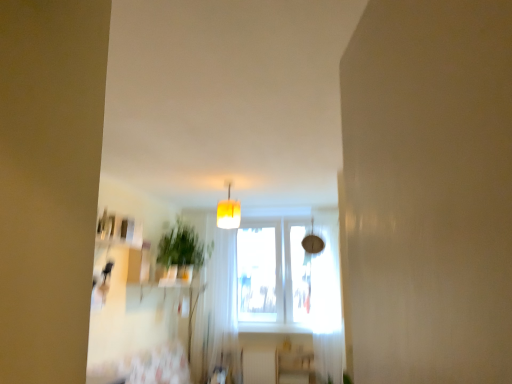
The width and height of the screenshot is (512, 384). What do you see at coordinates (223, 305) in the screenshot? I see `white sheer curtain at center, which appears as the 2th curtain when viewed from the right` at bounding box center [223, 305].

In order to click on wooden shelf at lower center in this screenshot , I will do [296, 367].

At what (x,y) coordinates should I click in order to perform the action: click on white sheer curtain at right, which appears as the 2th curtain when viewed from the left. Please return your answer as a coordinate pair (x, y). The height and width of the screenshot is (384, 512). Looking at the image, I should click on (327, 307).

From a real-world perspective, which is physically below, white sheer curtain at center, which appears as the 2th curtain when viewed from the right, or yellow fabric lampshade at center?

From a 3D spatial view, white sheer curtain at center, which appears as the 2th curtain when viewed from the right, is below.

Can you confirm if white sheer curtain at center, which appears as the 2th curtain when viewed from the right, is smaller than yellow fabric lampshade at center?

No, white sheer curtain at center, which appears as the 2th curtain when viewed from the right, is not smaller than yellow fabric lampshade at center.

Identify the location of light fixture lying above the white sheer curtain at center, which appears as the 2th curtain when viewed from the right (from the image's perspective). (228, 212).

From a real-world perspective, which object rests below the other?

white sheer curtain at right, which appears as the 1th curtain when viewed from the right, from a real-world perspective.

Is white sheer curtain at center, which appears as the 2th curtain when viewed from the right, facing towards white sheer curtain at right, which appears as the 1th curtain when viewed from the right?

No, white sheer curtain at center, which appears as the 2th curtain when viewed from the right, does not turn towards white sheer curtain at right, which appears as the 1th curtain when viewed from the right.

In the image, is white sheer curtain at center, marked as the first curtain in a left-to-right arrangement, positioned in front of or behind white sheer curtain at right, which appears as the 2th curtain when viewed from the left?

Clearly, white sheer curtain at center, marked as the first curtain in a left-to-right arrangement, is behind white sheer curtain at right, which appears as the 2th curtain when viewed from the left.

Can you tell me how much white sheer curtain at center, which appears as the 2th curtain when viewed from the right, and white sheer curtain at right, which appears as the 1th curtain when viewed from the right, differ in facing direction?

There is a 0.000287-degree angle between the facing directions of white sheer curtain at center, which appears as the 2th curtain when viewed from the right, and white sheer curtain at right, which appears as the 1th curtain when viewed from the right.

Consider the image. Is white sheer curtain at right, which appears as the 2th curtain when viewed from the left, to the right of green leafy plant at center from the viewer's perspective?

Yes.

Which is in front, white sheer curtain at right, which appears as the 1th curtain when viewed from the right, or green leafy plant at center?

green leafy plant at center.

Is white sheer curtain at right, which appears as the 2th curtain when viewed from the left, spatially inside green leafy plant at center, or outside of it?

white sheer curtain at right, which appears as the 2th curtain when viewed from the left, exists outside the volume of green leafy plant at center.

Does white sheer curtain at right, which appears as the 1th curtain when viewed from the right, touch green leafy plant at center?

white sheer curtain at right, which appears as the 1th curtain when viewed from the right, and green leafy plant at center are clearly separated.

Is green leafy plant at center facing towards white sheer curtain at center, marked as the first curtain in a left-to-right arrangement?

No.

Is green leafy plant at center positioned before white sheer curtain at center, which appears as the 2th curtain when viewed from the right?

That is True.

Can you confirm if green leafy plant at center is wider than white sheer curtain at center, marked as the first curtain in a left-to-right arrangement?

Indeed, green leafy plant at center has a greater width compared to white sheer curtain at center, marked as the first curtain in a left-to-right arrangement.

From a real-world perspective, which curtain is the 1st one underneath the green leafy plant at center? Please provide its 2D coordinates.

[(223, 305)]

Considering the positions of points (302, 356) and (217, 314), is point (302, 356) farther from camera compared to point (217, 314)?

That is False.

Would you say wooden shelf at lower center is outside white sheer curtain at center, marked as the first curtain in a left-to-right arrangement?

Yes, wooden shelf at lower center is located beyond the bounds of white sheer curtain at center, marked as the first curtain in a left-to-right arrangement.

Which of these two, wooden shelf at lower center or white sheer curtain at center, marked as the first curtain in a left-to-right arrangement, is thinner?

wooden shelf at lower center.

Considering the sizes of objects wooden shelf at lower center and white sheer curtain at center, which appears as the 2th curtain when viewed from the right, in the image provided, who is shorter, wooden shelf at lower center or white sheer curtain at center, which appears as the 2th curtain when viewed from the right,?

wooden shelf at lower center is shorter.

Does yellow fabric lampshade at center come behind white sheer curtain at center, marked as the first curtain in a left-to-right arrangement?

No.

Is yellow fabric lampshade at center not close to white sheer curtain at center, marked as the first curtain in a left-to-right arrangement?

Yes.

From a real-world perspective, which is physically above, yellow fabric lampshade at center or white sheer curtain at center, marked as the first curtain in a left-to-right arrangement?

In real-world perspective, yellow fabric lampshade at center is above.

From the image's perspective, which is below, yellow fabric lampshade at center or white sheer curtain at center, which appears as the 2th curtain when viewed from the right?

white sheer curtain at center, which appears as the 2th curtain when viewed from the right, appears lower in the image.

Is white sheer curtain at center, marked as the first curtain in a left-to-right arrangement, looking in the opposite direction of green leafy plant at center?

Yes, green leafy plant at center is at the back of white sheer curtain at center, marked as the first curtain in a left-to-right arrangement.

The width and height of the screenshot is (512, 384). What are the coordinates of `houseplant in front of the white sheer curtain at center, which appears as the 2th curtain when viewed from the right` in the screenshot? It's located at (181, 251).

Can you confirm if white sheer curtain at center, marked as the first curtain in a left-to-right arrangement, is thinner than green leafy plant at center?

Indeed, white sheer curtain at center, marked as the first curtain in a left-to-right arrangement, has a lesser width compared to green leafy plant at center.

Is white sheer curtain at center, marked as the first curtain in a left-to-right arrangement, positioned far away from green leafy plant at center?

They are positioned close to each other.

Where is `light fixture above the white sheer curtain at center, marked as the first curtain in a left-to-right arrangement (from a real-world perspective)`? The image size is (512, 384). light fixture above the white sheer curtain at center, marked as the first curtain in a left-to-right arrangement (from a real-world perspective) is located at coordinates (228, 212).

Find the location of a particular element. curtain located above the white sheer curtain at right, which appears as the 1th curtain when viewed from the right (from the image's perspective) is located at coordinates (223, 305).

Based on their spatial positions, is green leafy plant at center or white sheer curtain at center, which appears as the 2th curtain when viewed from the right, closer to white sheer curtain at right, which appears as the 2th curtain when viewed from the left?

white sheer curtain at center, which appears as the 2th curtain when viewed from the right, is closer to white sheer curtain at right, which appears as the 2th curtain when viewed from the left.

From the picture: Based on their spatial positions, is white sheer curtain at right, which appears as the 1th curtain when viewed from the right, or green leafy plant at center further from white sheer curtain at center, which appears as the 2th curtain when viewed from the right?

Among the two, white sheer curtain at right, which appears as the 1th curtain when viewed from the right, is located further to white sheer curtain at center, which appears as the 2th curtain when viewed from the right.

Based on their spatial positions, is white sheer curtain at center, marked as the first curtain in a left-to-right arrangement, or yellow fabric lampshade at center further from green leafy plant at center?

yellow fabric lampshade at center is positioned further to the anchor green leafy plant at center.

From the image, which object appears to be farther from white sheer curtain at right, which appears as the 2th curtain when viewed from the left, green leafy plant at center or wooden shelf at lower center?

The object further to white sheer curtain at right, which appears as the 2th curtain when viewed from the left, is green leafy plant at center.

When comparing their distances from white sheer curtain at center, marked as the first curtain in a left-to-right arrangement, does green leafy plant at center or wooden shelf at lower center seem further?

wooden shelf at lower center is further to white sheer curtain at center, marked as the first curtain in a left-to-right arrangement.

When comparing their distances from white sheer curtain at center, which appears as the 2th curtain when viewed from the right, does green leafy plant at center or yellow fabric lampshade at center seem further?

Based on the image, yellow fabric lampshade at center appears to be further to white sheer curtain at center, which appears as the 2th curtain when viewed from the right.

Based on their spatial positions, is green leafy plant at center or white sheer curtain at right, which appears as the 2th curtain when viewed from the left, further from white sheer curtain at center, which appears as the 2th curtain when viewed from the right?

white sheer curtain at right, which appears as the 2th curtain when viewed from the left.

From the image, which object appears to be nearer to yellow fabric lampshade at center, wooden shelf at lower center or white sheer curtain at center, marked as the first curtain in a left-to-right arrangement?

Based on the image, white sheer curtain at center, marked as the first curtain in a left-to-right arrangement, appears to be nearer to yellow fabric lampshade at center.

Find the location of a particular element. This screenshot has width=512, height=384. light fixture between white sheer curtain at center, marked as the first curtain in a left-to-right arrangement, and white sheer curtain at right, which appears as the 1th curtain when viewed from the right is located at coordinates (228, 212).

Image resolution: width=512 pixels, height=384 pixels. In order to click on furniture situated between green leafy plant at center and white sheer curtain at right, which appears as the 2th curtain when viewed from the left, from left to right in this screenshot , I will do pos(296,367).

Where is `furniture situated between white sheer curtain at center, marked as the first curtain in a left-to-right arrangement, and white sheer curtain at right, which appears as the 1th curtain when viewed from the right, from left to right`? furniture situated between white sheer curtain at center, marked as the first curtain in a left-to-right arrangement, and white sheer curtain at right, which appears as the 1th curtain when viewed from the right, from left to right is located at coordinates (296, 367).

Image resolution: width=512 pixels, height=384 pixels. Identify the location of houseplant between yellow fabric lampshade at center and white sheer curtain at center, marked as the first curtain in a left-to-right arrangement, in the vertical direction. (181, 251).